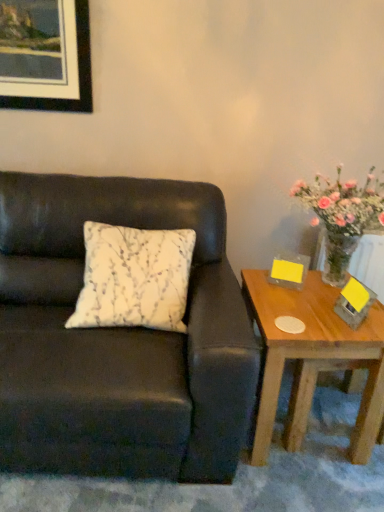
Question: Can you confirm if white printed cushion at center is positioned to the right of matte black couch at left?

Choices:
 (A) no
 (B) yes

Answer: (B)

Question: Can you confirm if white printed cushion at center is wider than matte black couch at left?

Choices:
 (A) yes
 (B) no

Answer: (B)

Question: From a real-world perspective, is white printed cushion at center on top of matte black couch at left?

Choices:
 (A) yes
 (B) no

Answer: (A)

Question: Is matte black couch at left inside white printed cushion at center?

Choices:
 (A) yes
 (B) no

Answer: (B)

Question: From the image's perspective, is white printed cushion at center on matte black couch at left?

Choices:
 (A) no
 (B) yes

Answer: (B)

Question: From a real-world perspective, is white printed cushion at center under matte black couch at left?

Choices:
 (A) yes
 (B) no

Answer: (B)

Question: Considering the relative positions of white printed cushion at center and matte black picture frame at upper left in the image provided, is white printed cushion at center to the left of matte black picture frame at upper left from the viewer's perspective?

Choices:
 (A) yes
 (B) no

Answer: (B)

Question: Does white printed cushion at center come behind matte black picture frame at upper left?

Choices:
 (A) yes
 (B) no

Answer: (B)

Question: Is the position of white printed cushion at center less distant than that of matte black picture frame at upper left?

Choices:
 (A) yes
 (B) no

Answer: (A)

Question: Does white printed cushion at center have a smaller size compared to matte black picture frame at upper left?

Choices:
 (A) no
 (B) yes

Answer: (A)

Question: From the image's perspective, does white printed cushion at center appear lower than matte black picture frame at upper left?

Choices:
 (A) yes
 (B) no

Answer: (A)

Question: Is white printed cushion at center oriented towards matte black picture frame at upper left?

Choices:
 (A) no
 (B) yes

Answer: (A)

Question: Considering the relative sizes of matte black picture frame at upper left and wooden table at right in the image provided, is matte black picture frame at upper left thinner than wooden table at right?

Choices:
 (A) yes
 (B) no

Answer: (A)